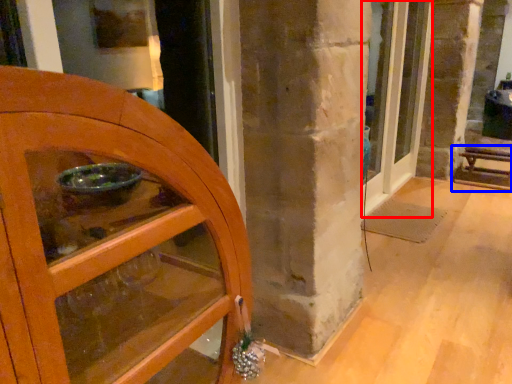
Question: Which object appears closest to the camera in this image, door (highlighted by a red box) or furniture (highlighted by a blue box)?

Choices:
 (A) door
 (B) furniture

Answer: (A)